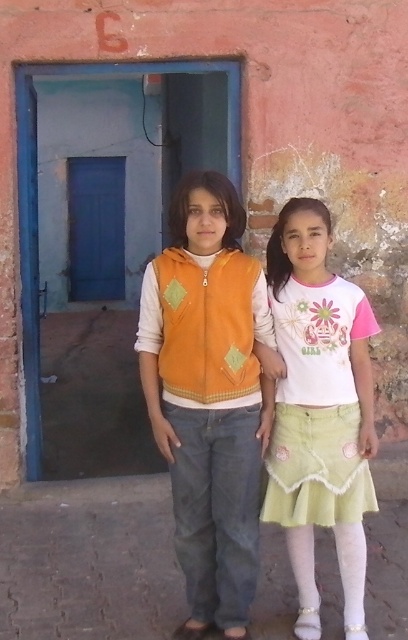
The width and height of the screenshot is (408, 640). What do you see at coordinates (208, 396) in the screenshot?
I see `orange fleece vest at center` at bounding box center [208, 396].

Which is behind, point (204, 429) or point (317, 372)?

Point (317, 372)

Is point (188, 291) closer to camera compared to point (346, 369)?

Yes, point (188, 291) is in front of point (346, 369).

Find the location of a particular element. orange fleece vest at center is located at coordinates (208, 396).